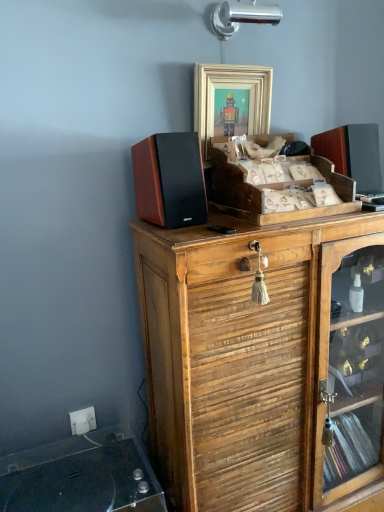
Where is `gold-toned wooden frame at upper center`? This screenshot has height=512, width=384. gold-toned wooden frame at upper center is located at coordinates tap(231, 102).

Measure the distance between point [264,168] and camera.

Point [264,168] and camera are 1.28 meters apart from each other.

This screenshot has height=512, width=384. Describe the element at coordinates (275, 186) in the screenshot. I see `wooden crate at center, placed as the 2th cabinetry when sorted from bottom to top` at that location.

Locate an element on the screen. This screenshot has width=384, height=512. clear glass record player at lower left is located at coordinates (82, 476).

Consider the image. Who is bigger, clear glass record player at lower left or wooden cabinet at upper center, which ranks as the 2th cabinetry in top-to-bottom order?

Bigger between the two is wooden cabinet at upper center, which ranks as the 2th cabinetry in top-to-bottom order.

How many degrees apart are the facing directions of clear glass record player at lower left and wooden cabinet at upper center, which ranks as the 2th cabinetry in top-to-bottom order?

0.82 degrees separate the facing orientations of clear glass record player at lower left and wooden cabinet at upper center, which ranks as the 2th cabinetry in top-to-bottom order.

Relative to wooden cabinet at upper center, which is counted as the 1th cabinetry, starting from the bottom, is clear glass record player at lower left in front or behind?

clear glass record player at lower left is positioned closer to the viewer than wooden cabinet at upper center, which is counted as the 1th cabinetry, starting from the bottom.

Between clear glass record player at lower left and wooden cabinet at upper center, which ranks as the 2th cabinetry in top-to-bottom order, which one has more height?

Standing taller between the two is wooden cabinet at upper center, which ranks as the 2th cabinetry in top-to-bottom order.

Is gold-toned wooden frame at upper center shorter than white plastic electric outlet at lower left?

No, gold-toned wooden frame at upper center is not shorter than white plastic electric outlet at lower left.

From the image's perspective, is gold-toned wooden frame at upper center above white plastic electric outlet at lower left?

Indeed, from the image's perspective, gold-toned wooden frame at upper center is shown above white plastic electric outlet at lower left.

Considering the relative positions of gold-toned wooden frame at upper center and white plastic electric outlet at lower left in the image provided, is gold-toned wooden frame at upper center to the left or to the right of white plastic electric outlet at lower left?

Clearly, gold-toned wooden frame at upper center is on the right of white plastic electric outlet at lower left in the image.

Can you tell me how much wooden cabinet at upper center, which is counted as the 1th cabinetry, starting from the bottom, and white plastic electric outlet at lower left differ in facing direction?

The facing directions of wooden cabinet at upper center, which is counted as the 1th cabinetry, starting from the bottom, and white plastic electric outlet at lower left are 0.727 degrees apart.

Is wooden cabinet at upper center, which ranks as the 2th cabinetry in top-to-bottom order, facing towards white plastic electric outlet at lower left?

No, wooden cabinet at upper center, which ranks as the 2th cabinetry in top-to-bottom order, is not oriented towards white plastic electric outlet at lower left.

In the scene shown: Is wooden cabinet at upper center, which ranks as the 2th cabinetry in top-to-bottom order, in contact with white plastic electric outlet at lower left?

No, wooden cabinet at upper center, which ranks as the 2th cabinetry in top-to-bottom order, is not making contact with white plastic electric outlet at lower left.

From a real-world perspective, is wooden cabinet at upper center, which is counted as the 1th cabinetry, starting from the bottom, beneath white plastic electric outlet at lower left?

No, from a real-world perspective, wooden cabinet at upper center, which is counted as the 1th cabinetry, starting from the bottom, is not beneath white plastic electric outlet at lower left.

How much distance is there between clear glass record player at lower left and wooden crate at center, placed as the 2th cabinetry when sorted from bottom to top?

clear glass record player at lower left and wooden crate at center, placed as the 2th cabinetry when sorted from bottom to top, are 36.30 inches apart.

Is clear glass record player at lower left oriented away from wooden crate at center, placed as the first cabinetry when sorted from top to bottom?

No, clear glass record player at lower left's orientation is not away from wooden crate at center, placed as the first cabinetry when sorted from top to bottom.

From the image's perspective, is clear glass record player at lower left positioned above or below wooden crate at center, placed as the first cabinetry when sorted from top to bottom?

clear glass record player at lower left is situated lower than wooden crate at center, placed as the first cabinetry when sorted from top to bottom, in the image.

Considering the points (106, 430) and (283, 211), which point is in front, point (106, 430) or point (283, 211)?

Point (283, 211)

From the image's perspective, is clear glass record player at lower left over gold-toned wooden frame at upper center?

No, from the image's perspective, clear glass record player at lower left is not on top of gold-toned wooden frame at upper center.

Can gold-toned wooden frame at upper center be found inside clear glass record player at lower left?

Definitely not — gold-toned wooden frame at upper center is not inside clear glass record player at lower left.

From a real-world perspective, is clear glass record player at lower left positioned above or below gold-toned wooden frame at upper center?

From a real-world perspective, clear glass record player at lower left is physically below gold-toned wooden frame at upper center.

Can you confirm if clear glass record player at lower left is wider than gold-toned wooden frame at upper center?

Correct, the width of clear glass record player at lower left exceeds that of gold-toned wooden frame at upper center.

Measure the distance between white plastic electric outlet at lower left and gold-toned wooden frame at upper center.

white plastic electric outlet at lower left and gold-toned wooden frame at upper center are 1.14 meters apart from each other.

Does white plastic electric outlet at lower left touch gold-toned wooden frame at upper center?

No, white plastic electric outlet at lower left is not beside gold-toned wooden frame at upper center.

Does point (88, 408) appear closer or farther from the camera than point (240, 78)?

Point (88, 408) appears to be farther away from the viewer than point (240, 78).

From the image's perspective, is white plastic electric outlet at lower left on gold-toned wooden frame at upper center?

No, from the image's perspective, white plastic electric outlet at lower left is not on top of gold-toned wooden frame at upper center.

How different are the orientations of wooden cabinet at upper center, which ranks as the 2th cabinetry in top-to-bottom order, and clear glass record player at lower left in degrees?

wooden cabinet at upper center, which ranks as the 2th cabinetry in top-to-bottom order, and clear glass record player at lower left are facing 0.82 degrees away from each other.

You are a GUI agent. You are given a task and a screenshot of the screen. Output one action in this format:
    pyautogui.click(x=<x>, y=<y>)
    Task: Click on the wide directly beneath the wooden cabinet at upper center, which ranks as the 2th cabinetry in top-to-bottom order (from a real-world perspective)
    The height and width of the screenshot is (512, 384).
    Given the screenshot: What is the action you would take?
    pyautogui.click(x=82, y=476)

Is wooden cabinet at upper center, which ranks as the 2th cabinetry in top-to-bottom order, looking in the opposite direction of clear glass record player at lower left?

No, clear glass record player at lower left is not at the back of wooden cabinet at upper center, which ranks as the 2th cabinetry in top-to-bottom order.

Who is more distant, wooden cabinet at upper center, which ranks as the 2th cabinetry in top-to-bottom order, or clear glass record player at lower left?

wooden cabinet at upper center, which ranks as the 2th cabinetry in top-to-bottom order, is more distant.

Which cabinetry is the 2nd one when counting from the right side of the clear glass record player at lower left? Please provide its 2D coordinates.

[(264, 360)]

Locate an element on the screen. electric outlet behind the gold-toned wooden frame at upper center is located at coordinates (82, 421).

Based on their spatial positions, is white plastic electric outlet at lower left or gold-toned wooden frame at upper center closer to wooden crate at center, placed as the first cabinetry when sorted from top to bottom?

gold-toned wooden frame at upper center.

Estimate the real-world distances between objects in this image. Which object is closer to gold-toned wooden frame at upper center, wooden cabinet at upper center, which ranks as the 2th cabinetry in top-to-bottom order, or white plastic electric outlet at lower left?

wooden cabinet at upper center, which ranks as the 2th cabinetry in top-to-bottom order, is closer to gold-toned wooden frame at upper center.

Looking at this image, when comparing their distances from white plastic electric outlet at lower left, does gold-toned wooden frame at upper center or clear glass record player at lower left seem closer?

The object closer to white plastic electric outlet at lower left is clear glass record player at lower left.

Consider the image. When comparing their distances from wooden cabinet at upper center, which ranks as the 2th cabinetry in top-to-bottom order, does wooden crate at center, placed as the 2th cabinetry when sorted from bottom to top, or white plastic electric outlet at lower left seem further?

Based on the image, white plastic electric outlet at lower left appears to be further to wooden cabinet at upper center, which ranks as the 2th cabinetry in top-to-bottom order.

Which object lies further to the anchor point clear glass record player at lower left, white plastic electric outlet at lower left or wooden cabinet at upper center, which is counted as the 1th cabinetry, starting from the bottom?

The object further to clear glass record player at lower left is wooden cabinet at upper center, which is counted as the 1th cabinetry, starting from the bottom.

Considering their positions, is clear glass record player at lower left positioned closer to wooden cabinet at upper center, which ranks as the 2th cabinetry in top-to-bottom order, than white plastic electric outlet at lower left?

Among the two, clear glass record player at lower left is located nearer to wooden cabinet at upper center, which ranks as the 2th cabinetry in top-to-bottom order.

Considering their positions, is wooden cabinet at upper center, which is counted as the 1th cabinetry, starting from the bottom, positioned further to wooden crate at center, placed as the first cabinetry when sorted from top to bottom, than clear glass record player at lower left?

clear glass record player at lower left is positioned further to the anchor wooden crate at center, placed as the first cabinetry when sorted from top to bottom.

Estimate the real-world distances between objects in this image. Which object is closer to white plastic electric outlet at lower left, wooden cabinet at upper center, which ranks as the 2th cabinetry in top-to-bottom order, or wooden crate at center, placed as the 2th cabinetry when sorted from bottom to top?

Among the two, wooden cabinet at upper center, which ranks as the 2th cabinetry in top-to-bottom order, is located nearer to white plastic electric outlet at lower left.

Locate an element on the screen. wide situated between white plastic electric outlet at lower left and wooden cabinet at upper center, which is counted as the 1th cabinetry, starting from the bottom, from left to right is located at coordinates (82, 476).

The height and width of the screenshot is (512, 384). I want to click on cabinetry that lies between wooden crate at center, placed as the 2th cabinetry when sorted from bottom to top, and white plastic electric outlet at lower left from top to bottom, so click(x=264, y=360).

I want to click on electric outlet between wooden crate at center, placed as the 2th cabinetry when sorted from bottom to top, and clear glass record player at lower left vertically, so click(x=82, y=421).

Find the location of a particular element. cabinetry between gold-toned wooden frame at upper center and wooden cabinet at upper center, which ranks as the 2th cabinetry in top-to-bottom order, in the vertical direction is located at coordinates (275, 186).